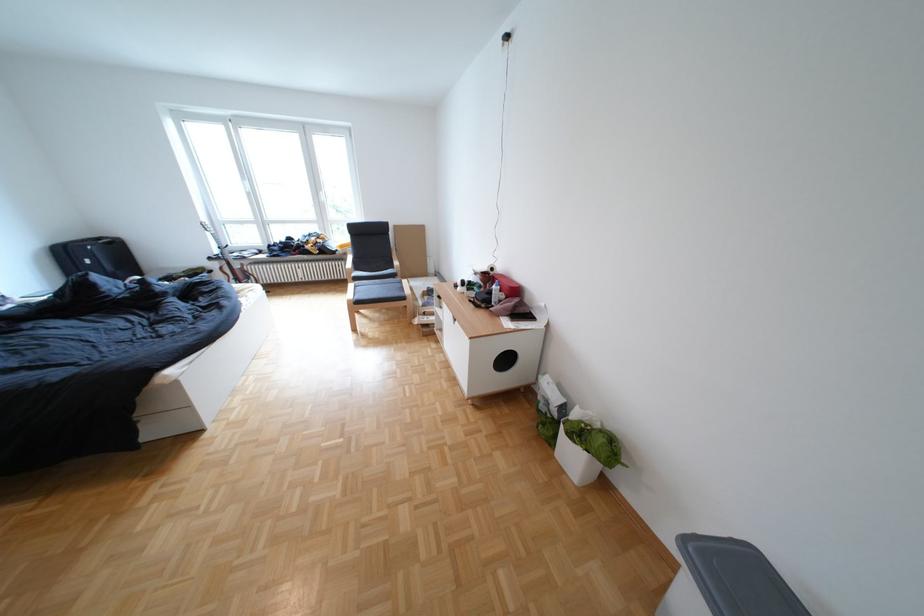
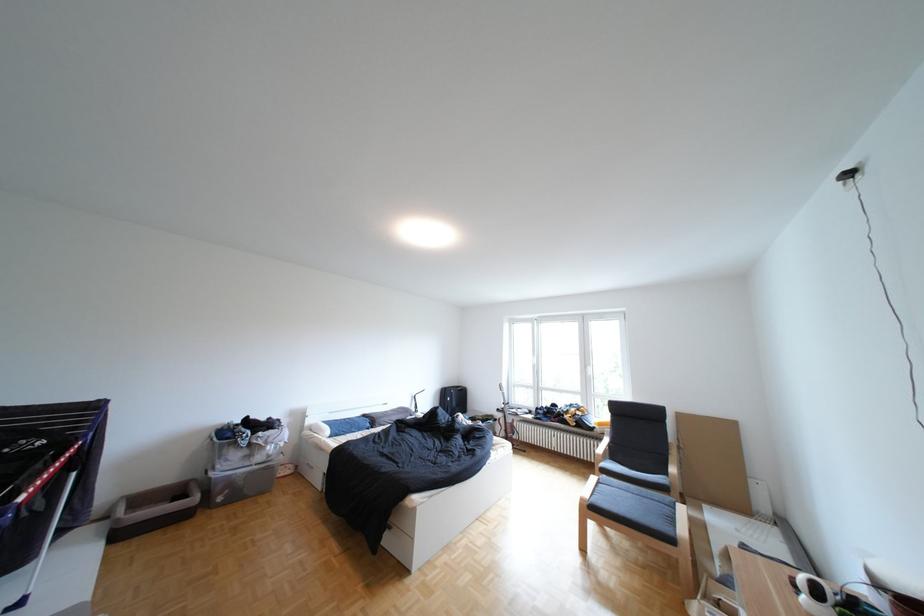
The point at [327,216] is marked in the first image. Where is the corresponding point in the second image?

(592, 387)